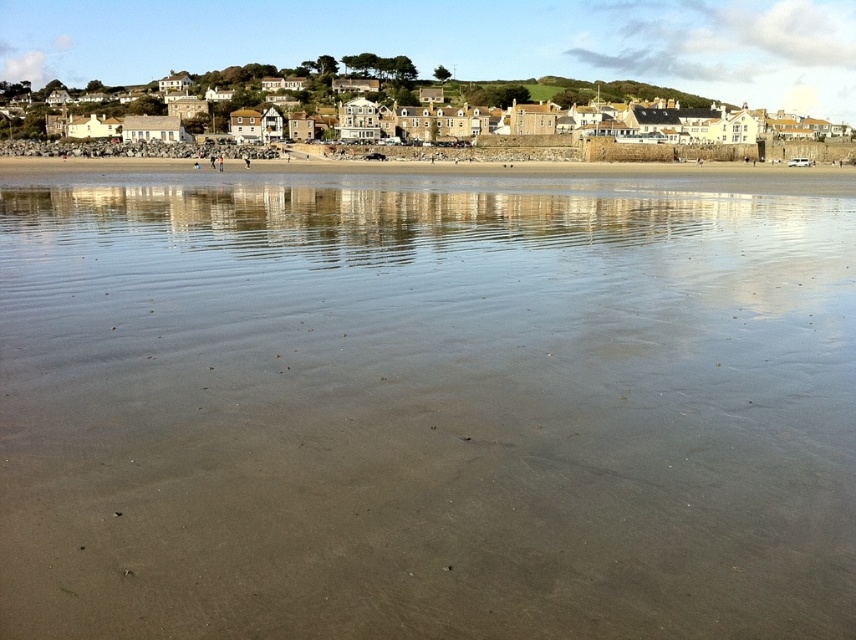
You are standing on the beach and see two points marked on the sand. The first is at point (557, 410) and the second is at point (578, 109). Which point is closer to you?

Point (557, 410) is in front of point (578, 109), so it is closer to you.

You are a photographer planning to capture the entire scene from the smooth sand at lower center to the white stone houses at upper center. Considering the width of both areas, which area would require a wider angle lens to include in the frame?

The white stone houses at upper center require a wider angle lens because their width is greater than the smooth sand at lower center.